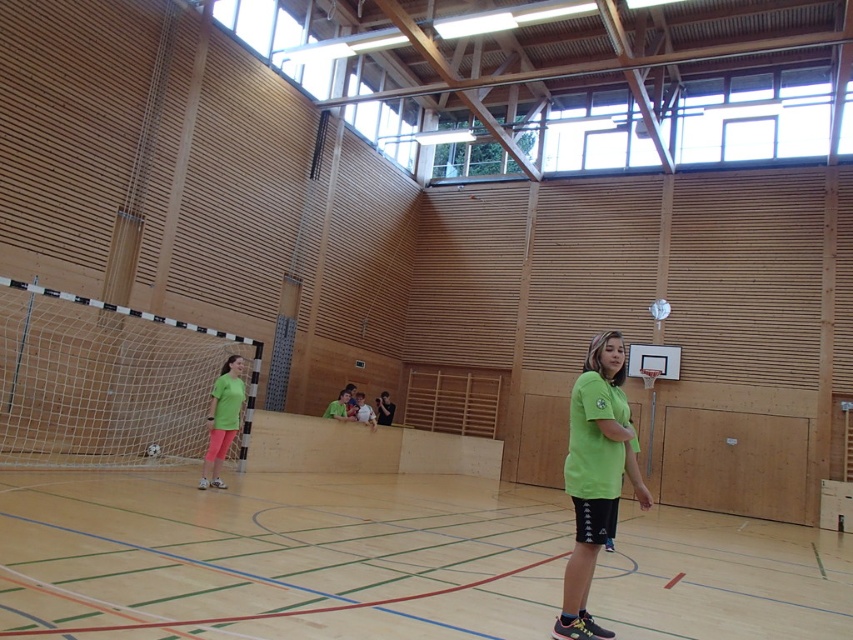
Question: Which object appears closest to the camera in this image?

Choices:
 (A) green matte shirt at lower left
 (B) green matte shirt at center

Answer: (B)

Question: Does green matte shirt at lower left have a greater width compared to light green jersey at center?

Choices:
 (A) no
 (B) yes

Answer: (B)

Question: Does green matte shirt at center come in front of light green jersey at center?

Choices:
 (A) no
 (B) yes

Answer: (B)

Question: Which point is farther to the camera?

Choices:
 (A) (225, 392)
 (B) (372, 426)
 (C) (28, 589)

Answer: (B)

Question: Does green matte shirt at lower left appear on the left side of light green jersey at center?

Choices:
 (A) no
 (B) yes

Answer: (B)

Question: Among these points, which one is farthest from the camera?

Choices:
 (A) (228, 372)
 (B) (368, 419)
 (C) (372, 529)

Answer: (B)